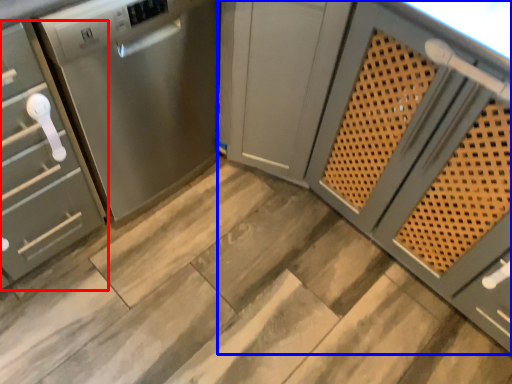
Question: Which of the following is the farthest to the observer, cabinetry (highlighted by a red box) or cabinetry (highlighted by a blue box)?

Choices:
 (A) cabinetry
 (B) cabinetry

Answer: (A)